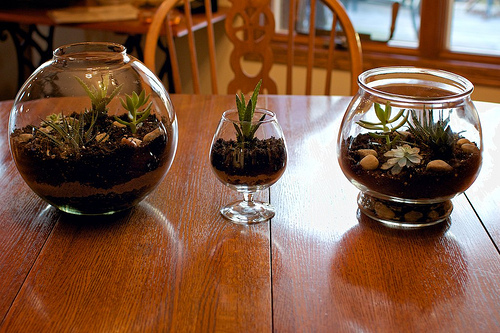
Where is `terrariums`? terrariums is located at coordinates (412, 162), (89, 142), (228, 147).